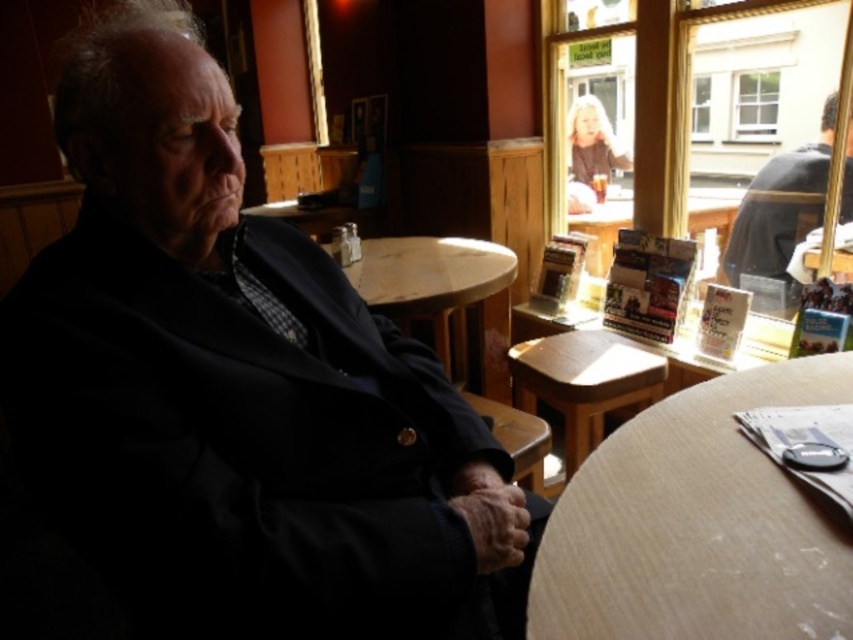
Who is positioned more to the left, matte black jacket at left or wooden at lower right?

matte black jacket at left

Who is more forward, (251, 305) or (708, 564)?

Positioned in front is point (708, 564).

Locate an element on the screen. matte black jacket at left is located at coordinates (239, 387).

Who is taller, wooden at lower right or wooden table at upper center?

Standing taller between the two is wooden table at upper center.

Which is behind, point (584, 588) or point (581, 227)?

Point (581, 227)

Find the location of `wooden at lower right`. wooden at lower right is located at coordinates (698, 525).

Can you confirm if marble table at center is bigger than wooden table at upper center?

Indeed, marble table at center has a larger size compared to wooden table at upper center.

Between point (491, 282) and point (718, 250), which one is positioned behind?

The point (718, 250) is behind.

Locate an element on the screen. The height and width of the screenshot is (640, 853). marble table at center is located at coordinates (444, 296).